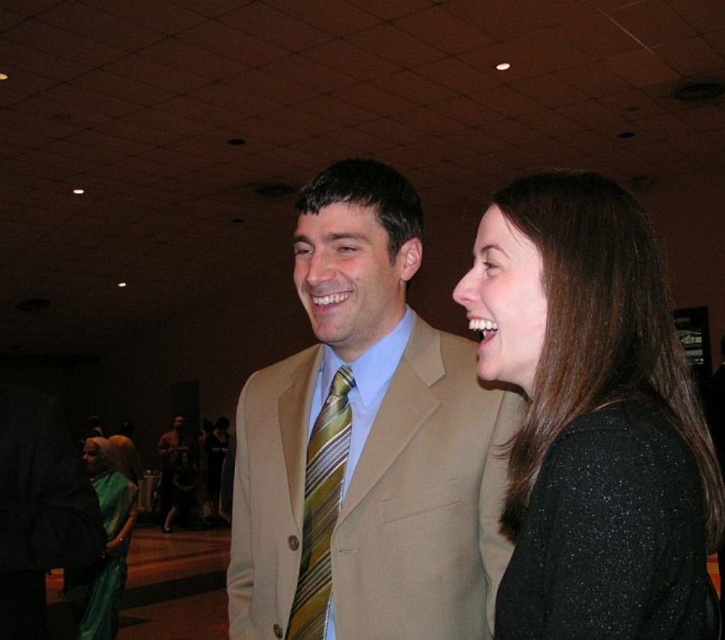
In the scene described, there is a point located at coordinates (610, 536). Based on the objects in the scene, which object is positioned at that point?

The point at (610, 536) indicates the black sparkly dress at right.

Based on the photo, you are organizing a charity event and need to determine which item takes up more space between the tan fabric suit at center and the yellow striped tie at center. Which one requires more storage space?

The tan fabric suit at center is larger in size than the yellow striped tie at center, so it requires more storage space.

You are a photographer setting up for an event. You need to decide which clothing item to focus on for a closeup shot. The tan fabric suit at center and the green silk saree at lower left are both in the frame. Which one is narrower in width?

The tan fabric suit at center is thinner than the green silk saree at lower left, so the tan fabric suit at center is narrower in width.